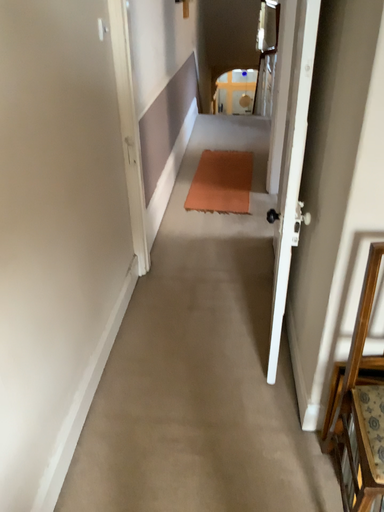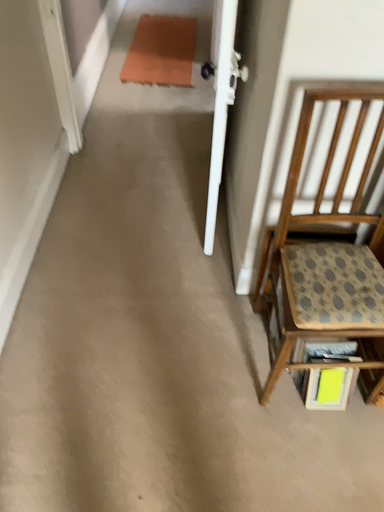
Question: Which way did the camera rotate in the video?

Choices:
 (A) rotated downward
 (B) rotated upward

Answer: (A)